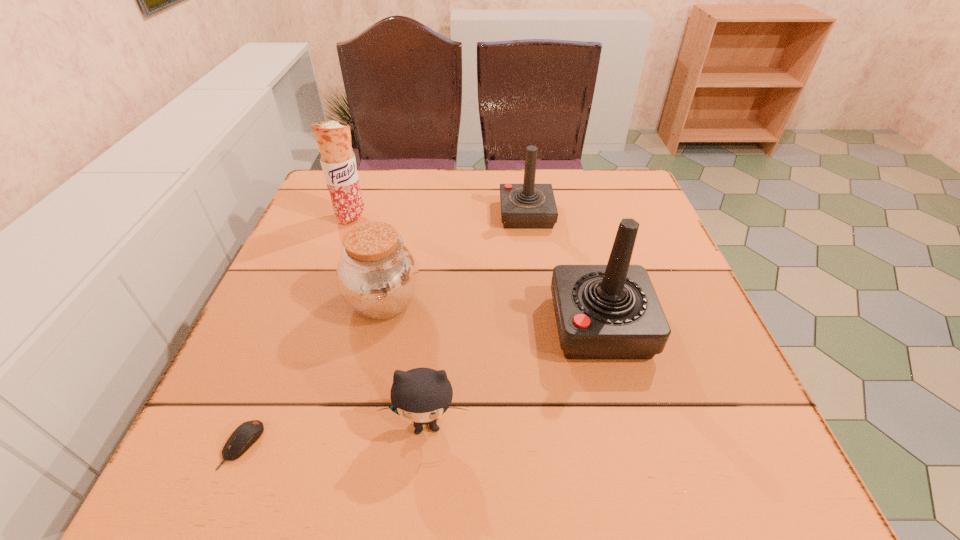
Locate an element on the screen. This screenshot has width=960, height=540. object present at the right edge is located at coordinates (611, 311).

The width and height of the screenshot is (960, 540). What are the coordinates of `object present at the far left corner` in the screenshot? It's located at (338, 162).

You are a GUI agent. You are given a task and a screenshot of the screen. Output one action in this format:
    pyautogui.click(x=<x>, y=<y>)
    Task: Click on the object present at the near left corner
    Image resolution: width=960 pixels, height=540 pixels.
    Given the screenshot: What is the action you would take?
    pyautogui.click(x=245, y=435)

What are the coordinates of `vacant space at the far edge of the desktop` in the screenshot? It's located at (398, 201).

In the image, there is a desktop. Where is `vacant region at the near edge`? This screenshot has height=540, width=960. vacant region at the near edge is located at coordinates coord(324,443).

Where is `vacant area at the left edge`? Image resolution: width=960 pixels, height=540 pixels. vacant area at the left edge is located at coordinates (318, 360).

In the image, there is a desktop. Where is `vacant space at the right edge`? Image resolution: width=960 pixels, height=540 pixels. vacant space at the right edge is located at coordinates (690, 293).

In the image, there is a desktop. In order to click on vacant space at the far right corner in this screenshot , I will do `click(624, 172)`.

Where is `vacant space at the near right corner`? vacant space at the near right corner is located at coordinates (708, 443).

Find the location of a particular element. This screenshot has height=540, width=960. free area in between the computer mouse and the jar is located at coordinates (313, 374).